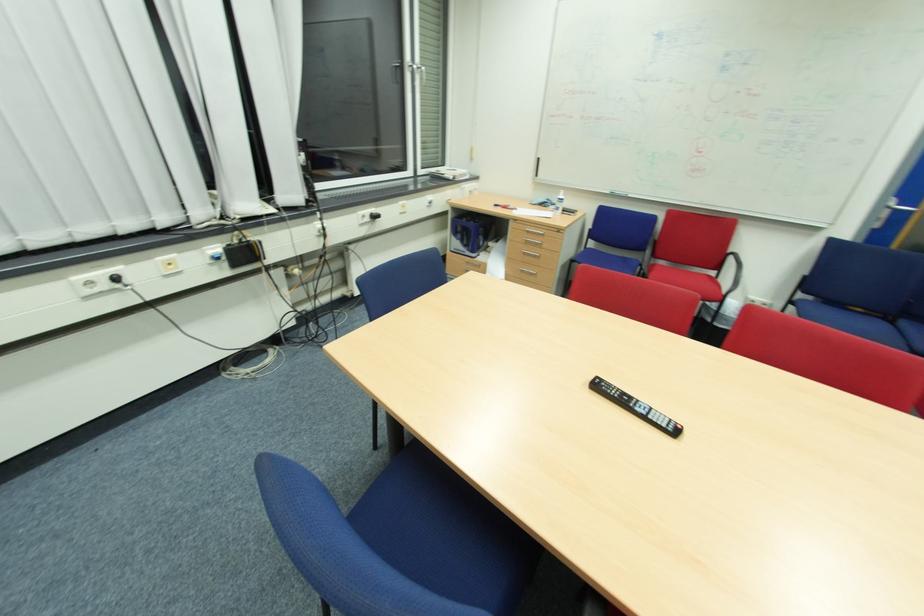
The width and height of the screenshot is (924, 616). Identify the location of the second silver drawer handle from top. (532, 241).